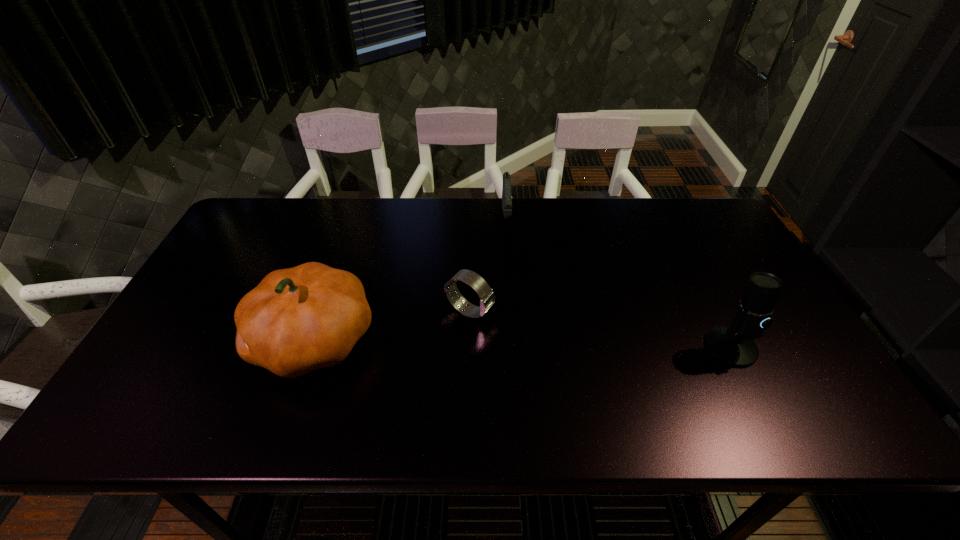
Image resolution: width=960 pixels, height=540 pixels. In order to click on the leftmost object in this screenshot , I will do `click(297, 320)`.

The height and width of the screenshot is (540, 960). In order to click on microphone in this screenshot , I will do pos(733,345).

Where is `the second object from left to right`? The width and height of the screenshot is (960, 540). the second object from left to right is located at coordinates (487, 297).

Locate an element on the screen. The height and width of the screenshot is (540, 960). the farthest object is located at coordinates (506, 190).

The image size is (960, 540). Identify the location of the third object from left to right. (506, 190).

Locate an element on the screen. The image size is (960, 540). free region located 0.210m on the front face of the leftmost object is located at coordinates (167, 340).

At what (x,y) coordinates should I click in order to perform the action: click on vacant space situated on the front face of the leftmost object. Please return your answer as a coordinate pair (x, y). This screenshot has width=960, height=540. Looking at the image, I should click on (203, 340).

Locate an element on the screen. The width and height of the screenshot is (960, 540). free space located 0.100m on the front face of the leftmost object is located at coordinates (210, 340).

The width and height of the screenshot is (960, 540). Identify the location of free space located 0.400m on the back of the rightmost object. (672, 232).

Where is `free point located on the face of the watch`? free point located on the face of the watch is located at coordinates 541,345.